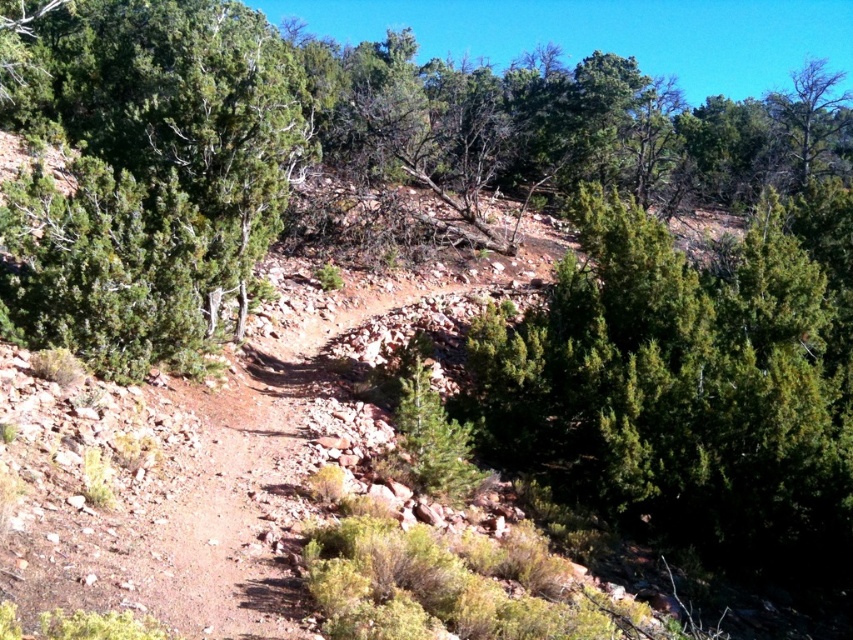
Question: Which point is farther to the camera?

Choices:
 (A) green needle-like at right
 (B) green needle-like at left

Answer: (A)

Question: Which point appears farthest from the camera in this image?

Choices:
 (A) [381, 220]
 (B) [206, 337]

Answer: (A)

Question: Does green needle-like at right have a larger size compared to green needle-like at left?

Choices:
 (A) yes
 (B) no

Answer: (B)

Question: Can you confirm if green textured bush at center is positioned below green needle-like at right?

Choices:
 (A) no
 (B) yes

Answer: (A)

Question: Is green textured bush at center further to the viewer compared to green needle-like at left?

Choices:
 (A) yes
 (B) no

Answer: (A)

Question: Which of the following is the farthest from the observer?

Choices:
 (A) (672, 96)
 (B) (567, 429)
 (C) (82, 294)

Answer: (A)